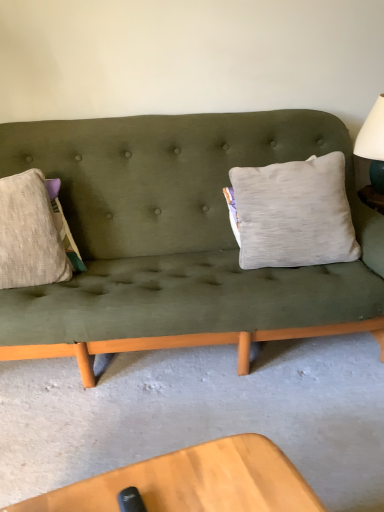
Question: From a real-world perspective, is gray fabric pillow at center-right above or below white matte table lamp at upper right?

Choices:
 (A) below
 (B) above

Answer: (A)

Question: Considering the positions of gray fabric pillow at center-right and white matte table lamp at upper right in the image, is gray fabric pillow at center-right bigger or smaller than white matte table lamp at upper right?

Choices:
 (A) small
 (B) big

Answer: (B)

Question: Is gray fabric pillow at center-right inside the boundaries of white matte table lamp at upper right, or outside?

Choices:
 (A) outside
 (B) inside

Answer: (A)

Question: Do you think white matte table lamp at upper right is within gray fabric pillow at center-right, or outside of it?

Choices:
 (A) outside
 (B) inside

Answer: (A)

Question: Would you say white matte table lamp at upper right is to the left or to the right of gray fabric pillow at center-right in the picture?

Choices:
 (A) right
 (B) left

Answer: (A)

Question: From their relative heights in the image, would you say white matte table lamp at upper right is taller or shorter than gray fabric pillow at center-right?

Choices:
 (A) tall
 (B) short

Answer: (B)

Question: Does point (380, 173) appear closer or farther from the camera than point (269, 264)?

Choices:
 (A) farther
 (B) closer

Answer: (B)